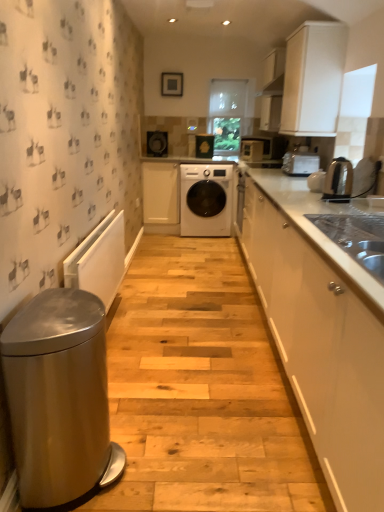
Question: From the image's perspective, is white matte washing machine at center located above or below satin silver toaster at upper right, placed as the first home appliance when sorted from top to bottom?

Choices:
 (A) above
 (B) below

Answer: (B)

Question: Considering the relative positions of white matte washing machine at center and satin silver toaster at upper right, placed as the first home appliance when sorted from top to bottom, in the image provided, is white matte washing machine at center to the left or to the right of satin silver toaster at upper right, placed as the first home appliance when sorted from top to bottom,?

Choices:
 (A) left
 (B) right

Answer: (A)

Question: Which is farther from the matte black speaker at upper center, the third appliance from the bottom?

Choices:
 (A) stainless steel sink at right
 (B) satin silver toaster at upper right, placed as the first home appliance when sorted from top to bottom
 (C) white matte cabinet at upper right, arranged as the 2th cabinetry when viewed from the back
 (D) white matte cabinet at center, which appears as the 3th cabinetry when viewed from the right
 (E) matte black washing machine at center, marked as the fourth appliance in a front-to-back arrangement

Answer: (A)

Question: Which of these objects is positioned farthest from the white glossy kettle at upper right, which is the first appliance in bottom-to-top order?

Choices:
 (A) stainless steel sink at right
 (B) white matte washing machine at center
 (C) white glossy cabinet at right, which is the 3th cabinetry in back-to-front order
 (D) matte black washing machine at center, marked as the fourth appliance in a front-to-back arrangement
 (E) white glossy microwave at upper center, the 2th appliance positioned from the right

Answer: (E)